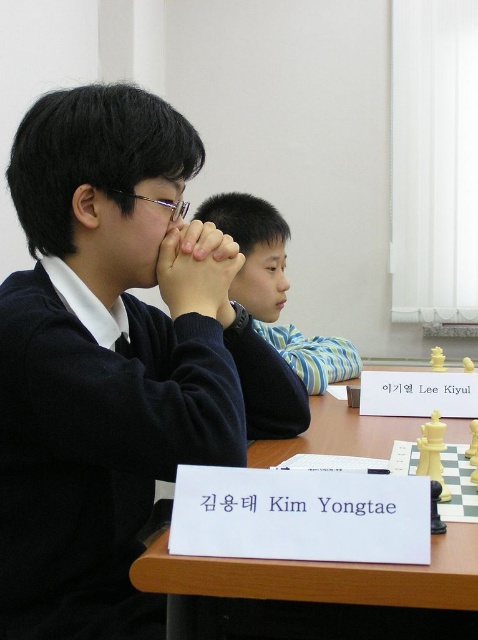
Question: Is dark blue sweater at center below blue striped shirt at center?

Choices:
 (A) yes
 (B) no

Answer: (A)

Question: Can you confirm if wooden table at center is wider than blue striped shirt at center?

Choices:
 (A) no
 (B) yes

Answer: (A)

Question: Estimate the real-world distances between objects in this image. Which object is closer to the blue striped shirt at center?

Choices:
 (A) dark blue sweater at center
 (B) wooden table at center

Answer: (B)

Question: Is dark blue sweater at center thinner than wooden table at center?

Choices:
 (A) no
 (B) yes

Answer: (A)

Question: Which point is closer to the camera?

Choices:
 (A) (156, 570)
 (B) (154, 332)

Answer: (A)

Question: Which object is closer to the camera taking this photo?

Choices:
 (A) blue striped shirt at center
 (B) wooden table at center

Answer: (B)